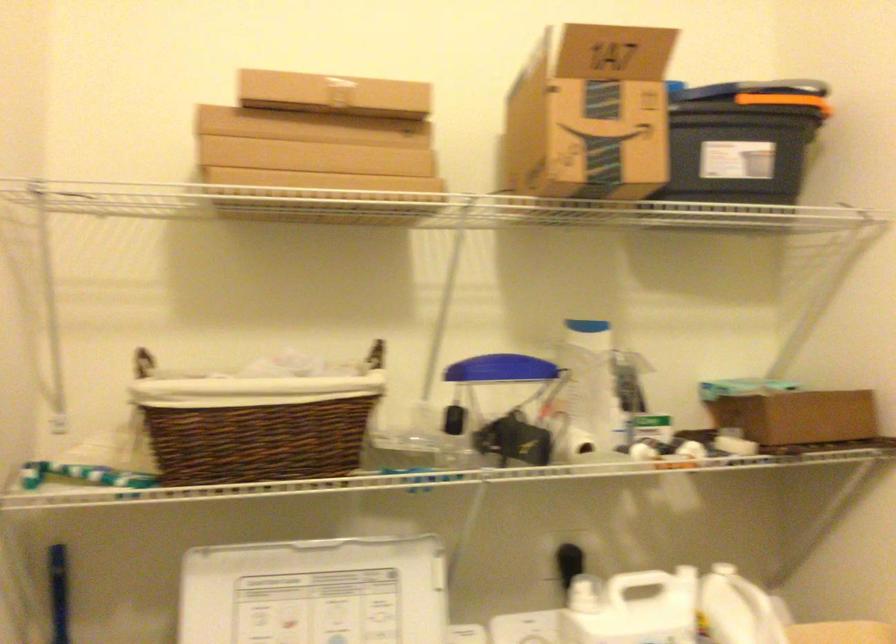
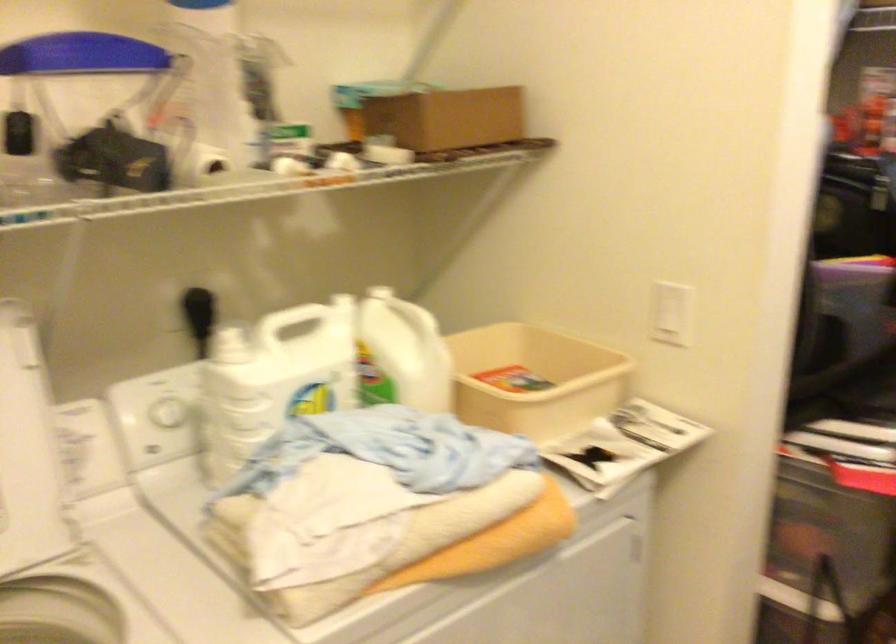
Locate, in the second image, the point that corresponds to pixel 794 424 in the first image.

(446, 118)